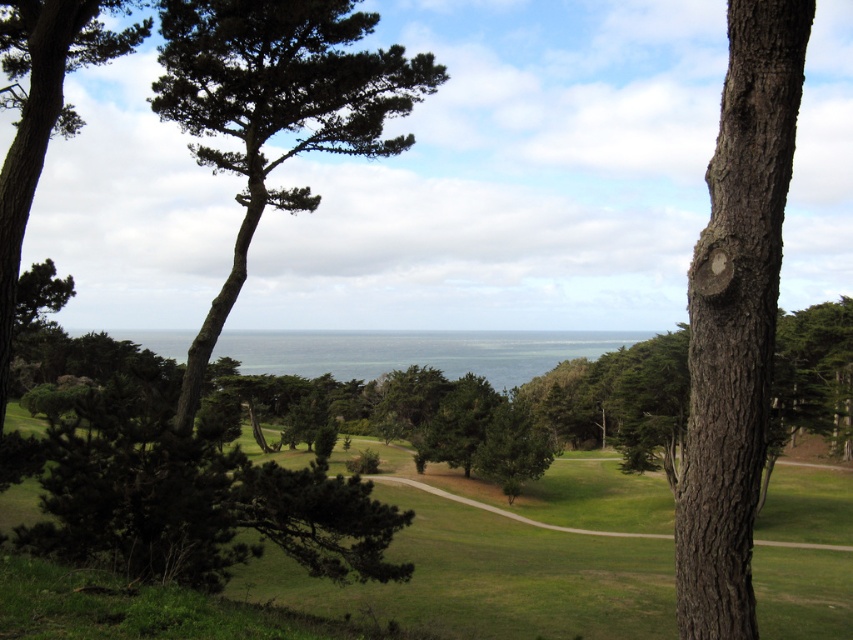
You are standing at the center of the winding path in the middle ground. You see a point marked at coordinate (735, 317). What object does this point indicate?

The point at coordinate (735, 317) marks the brown rough bark tree trunk at right.